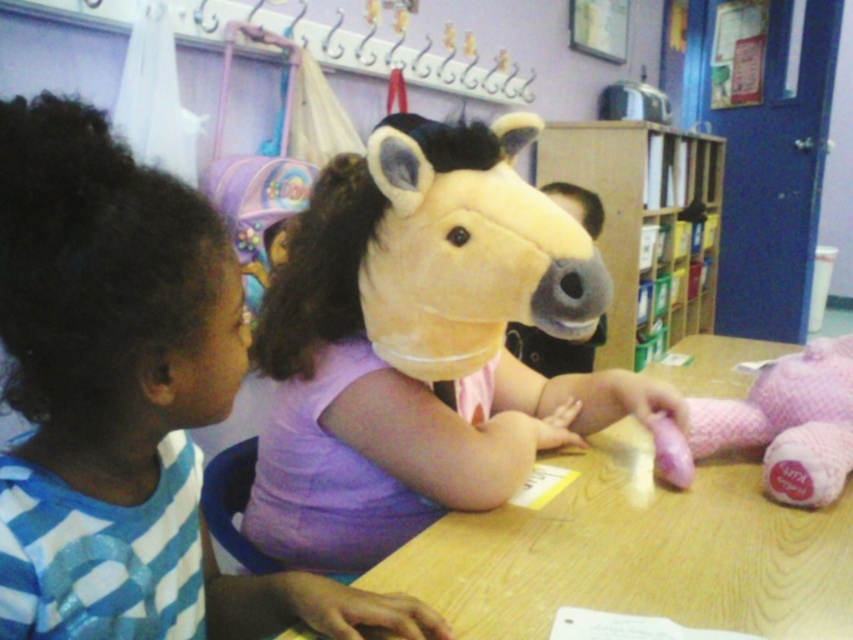
Does wooden table at center have a lesser height compared to wooden bookshelf at center?

Yes, wooden table at center is shorter than wooden bookshelf at center.

Does wooden table at center appear under wooden bookshelf at center?

Yes.

Is point (717, 506) in front of point (694, 296)?

Yes.

The image size is (853, 640). Find the location of `wooden table at center`. wooden table at center is located at coordinates (637, 552).

From the picture: Does soft plush horse head at center have a lesser width compared to wooden table at center?

Correct, soft plush horse head at center's width is less than wooden table at center's.

Does soft plush horse head at center appear on the right side of wooden table at center?

Incorrect, soft plush horse head at center is not on the right side of wooden table at center.

Which is behind, point (247, 536) or point (521, 586)?

The point (247, 536) is behind.

Image resolution: width=853 pixels, height=640 pixels. What are the coordinates of `soft plush horse head at center` in the screenshot? It's located at [x=422, y=346].

Between purple cotton shirt at upper center and wooden table at center, which one is positioned higher?

Positioned higher is purple cotton shirt at upper center.

Is the position of purple cotton shirt at upper center more distant than that of wooden table at center?

No, purple cotton shirt at upper center is in front of wooden table at center.

Is point (131, 506) less distant than point (444, 536)?

Yes, point (131, 506) is closer to viewer.

Where is `purple cotton shirt at upper center`? This screenshot has width=853, height=640. purple cotton shirt at upper center is located at coordinates (102, 333).